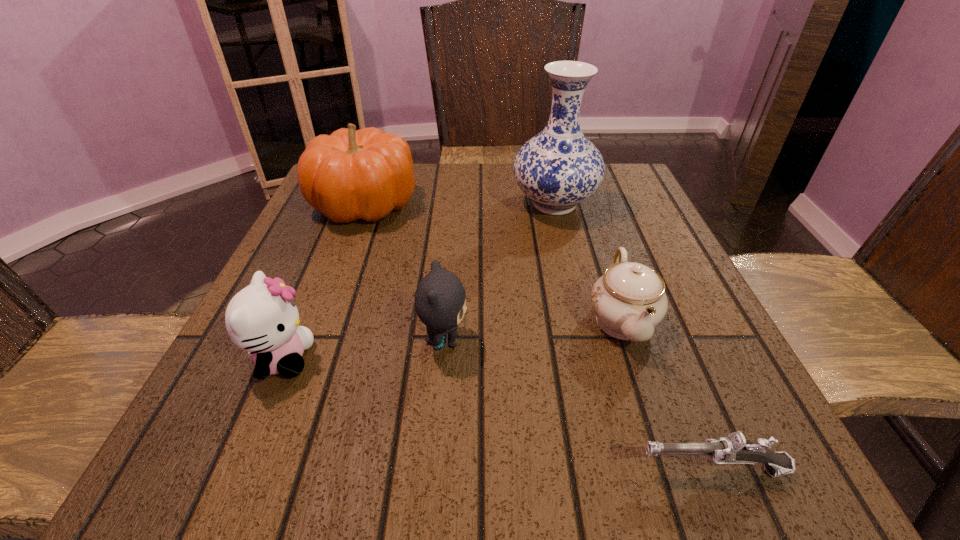
The height and width of the screenshot is (540, 960). I want to click on vacant space at the near left corner, so click(226, 448).

Where is `vacant space at the far right corner of the desktop`? vacant space at the far right corner of the desktop is located at coordinates (591, 204).

This screenshot has height=540, width=960. I want to click on unoccupied area between the third object from left to right and the left kitten, so click(x=363, y=349).

Identify the location of blank region between the left kitten and the shortest object. Image resolution: width=960 pixels, height=540 pixels. (497, 414).

The image size is (960, 540). In order to click on free space between the right kitten and the vase in this screenshot , I will do `click(499, 272)`.

Locate an element on the screen. Image resolution: width=960 pixels, height=540 pixels. free space between the fourth object from right to left and the vase is located at coordinates (499, 272).

The image size is (960, 540). I want to click on vacant space in between the gun and the right kitten, so click(x=578, y=405).

The width and height of the screenshot is (960, 540). Find the location of `vacant space that is in between the second tallest object and the right kitten`. vacant space that is in between the second tallest object and the right kitten is located at coordinates (404, 272).

In order to click on free space between the vase and the pumpkin in this screenshot , I will do `click(459, 204)`.

At what (x,y) coordinates should I click in order to perform the action: click on free point between the fourth object from right to left and the second tallest object. Please return your answer as a coordinate pair (x, y). Image resolution: width=960 pixels, height=540 pixels. Looking at the image, I should click on (404, 272).